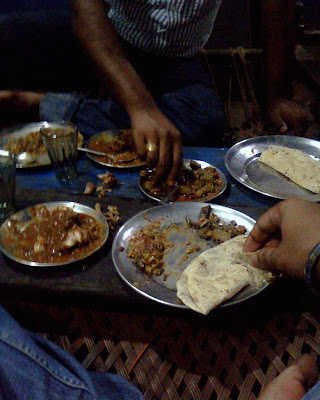
Locate an element on the screen. wicker is located at coordinates (160, 365).